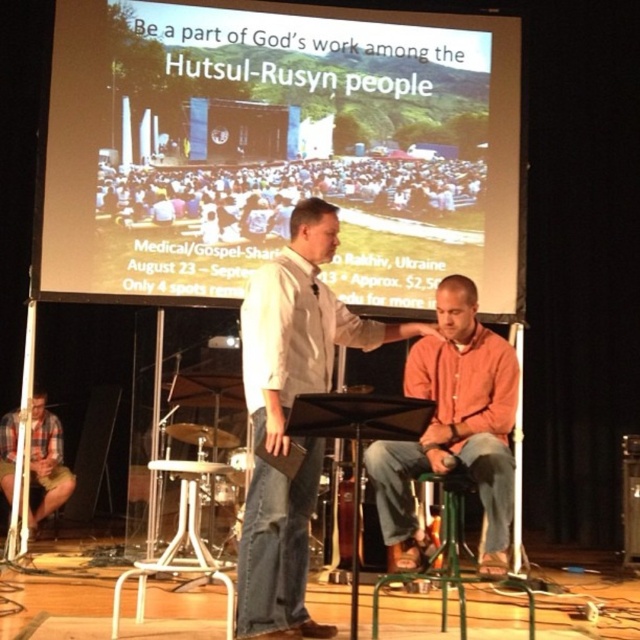
Question: Does orange cotton shirt at center have a greater width compared to brushed metal drum at lower left?

Choices:
 (A) yes
 (B) no

Answer: (A)

Question: Among these points, which one is farthest from the camera?

Choices:
 (A) (438, 483)
 (B) (195, 435)
 (C) (515, 371)
 (D) (268, 401)

Answer: (B)

Question: Is orange cotton shirt at center above brushed metal drum at lower left?

Choices:
 (A) yes
 (B) no

Answer: (A)

Question: Which object appears farthest from the camera in this image?

Choices:
 (A) brushed metal drum at lower left
 (B) orange cotton shirt at center
 (C) plaid cotton shorts at lower left

Answer: (C)

Question: Which object appears farthest from the camera in this image?

Choices:
 (A) orange cotton shirt at center
 (B) plaid cotton shorts at lower left
 (C) wooden floor at lower center

Answer: (B)

Question: Can you confirm if green metal stool at lower center is wider than brushed metal drum at lower left?

Choices:
 (A) yes
 (B) no

Answer: (A)